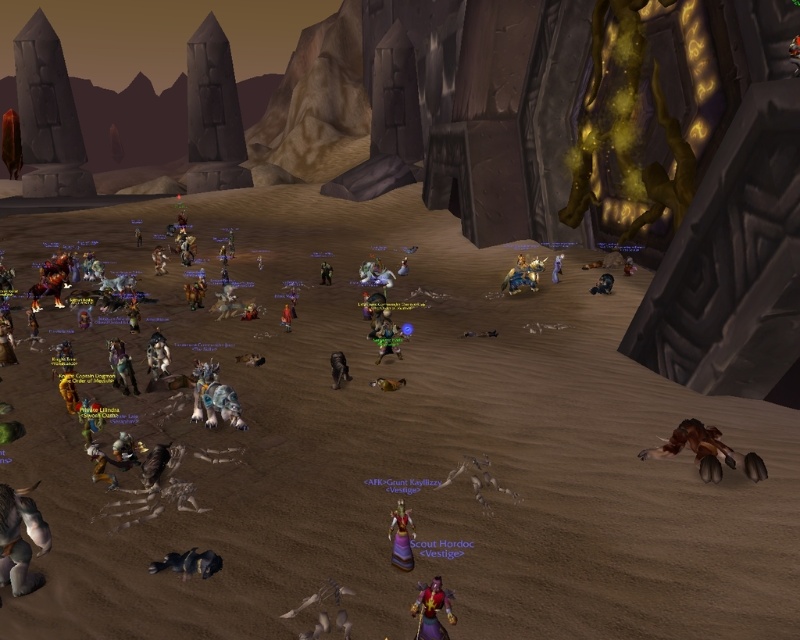
Question: From the image, what is the correct spatial relationship of white plastic toy at center in relation to shiny silver sword at center right?

Choices:
 (A) below
 (B) above

Answer: (A)

Question: Where is brown matte toy at lower right located in relation to shiny red armor at bottom center in the image?

Choices:
 (A) below
 (B) above

Answer: (B)

Question: Considering the real-world distances, which object is closest to the shiny silver sword at center right?

Choices:
 (A) shiny red toy at center
 (B) brown matte toy at lower right

Answer: (A)

Question: Which is nearer to the white plastic toy at center?

Choices:
 (A) shiny purple vestige at center
 (B) matte black toy at center
 (C) gold metallic armor at center

Answer: (A)

Question: Does brown matte toy at lower right have a larger size compared to white plastic toy at center?

Choices:
 (A) yes
 (B) no

Answer: (A)

Question: Which object is closer to the camera taking this photo?

Choices:
 (A) matte black toy at center
 (B) shiny red toy at center

Answer: (B)